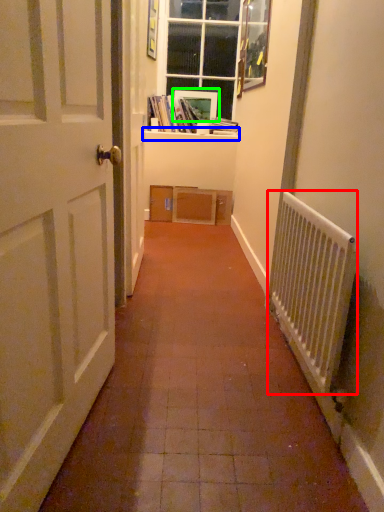
Question: Which is nearer to the radiator (highlighted by a red box)? window sill (highlighted by a blue box) or picture frame (highlighted by a green box).

Choices:
 (A) window sill
 (B) picture frame

Answer: (A)